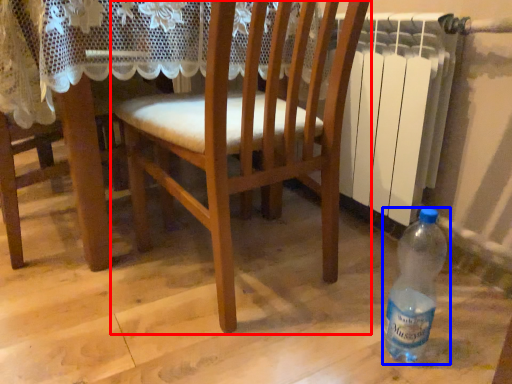
Question: Which object is further to the camera taking this photo, chair (highlighted by a red box) or bottle (highlighted by a blue box)?

Choices:
 (A) chair
 (B) bottle

Answer: (B)